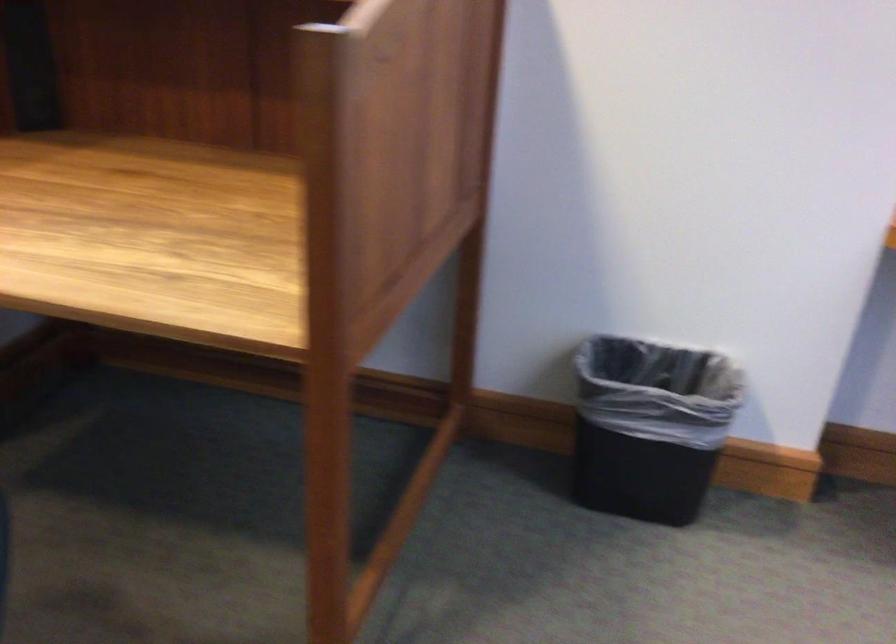
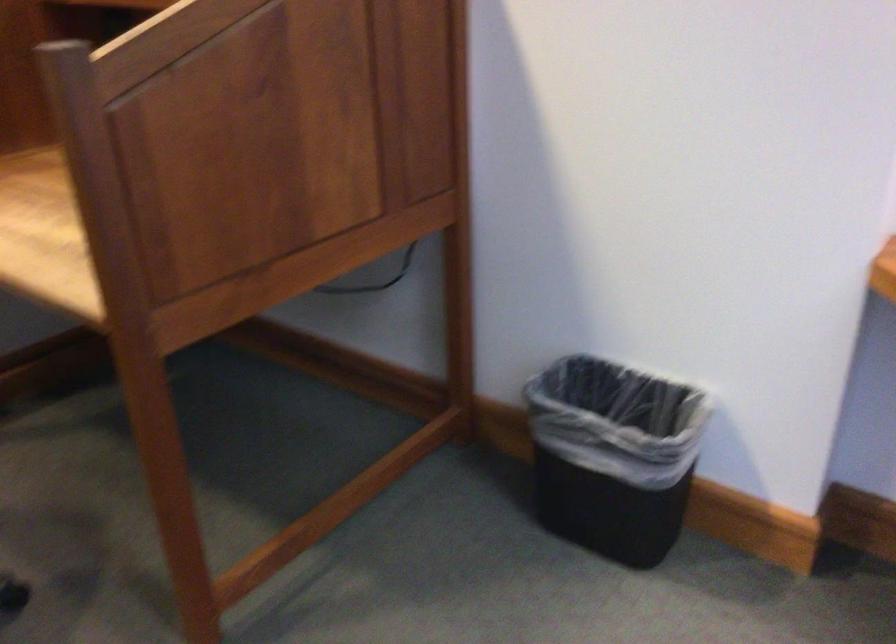
Question: Which direction would the cameraman need to move to produce the second image? Reply with the corresponding letter.

Choices:
 (A) Left
 (B) Right
 (C) Forward
 (D) Backward

Answer: (B)